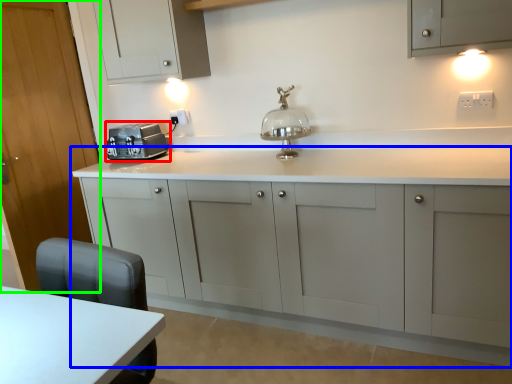
Question: Which is nearer to the home appliance (highlighted by a red box)? cabinetry (highlighted by a blue box) or door (highlighted by a green box).

Choices:
 (A) cabinetry
 (B) door

Answer: (B)